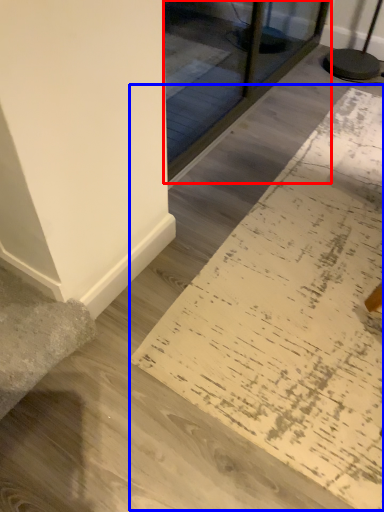
Question: Which object appears farthest to the camera in this image, glass door (highlighted by a red box) or doormat (highlighted by a blue box)?

Choices:
 (A) glass door
 (B) doormat

Answer: (A)